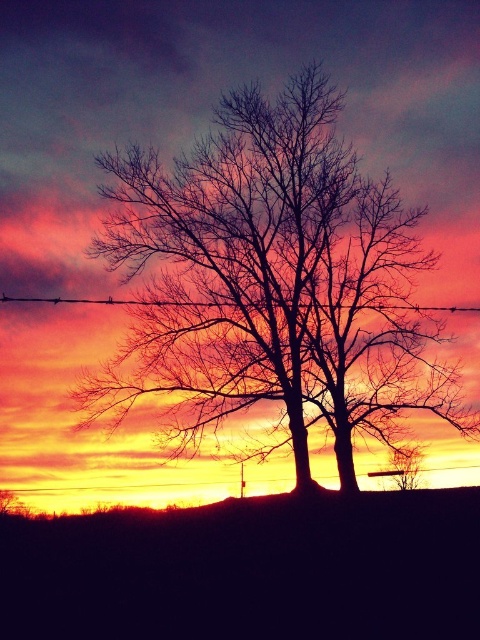
Does bare branches at center appear under barbed wire at center?

No.

Is point (262, 202) closer to camera compared to point (437, 310)?

Yes.

What do you see at coordinates (263, 276) in the screenshot? Image resolution: width=480 pixels, height=640 pixels. I see `bare branches at center` at bounding box center [263, 276].

The image size is (480, 640). Identify the location of bare branches at center. (263, 276).

Does bare branches at center have a smaller size compared to bare wood tree at lower right?

Incorrect, bare branches at center is not smaller in size than bare wood tree at lower right.

What do you see at coordinates (263, 276) in the screenshot? The width and height of the screenshot is (480, 640). I see `bare branches at center` at bounding box center [263, 276].

The height and width of the screenshot is (640, 480). What are the coordinates of `bare branches at center` in the screenshot? It's located at (263, 276).

Does barbed wire at center appear over bare wood tree at lower right?

Yes, barbed wire at center is above bare wood tree at lower right.

Is point (408, 305) positioned after point (404, 486)?

Yes, point (408, 305) is behind point (404, 486).

Where is `barbed wire at center`? The image size is (480, 640). barbed wire at center is located at coordinates (111, 301).